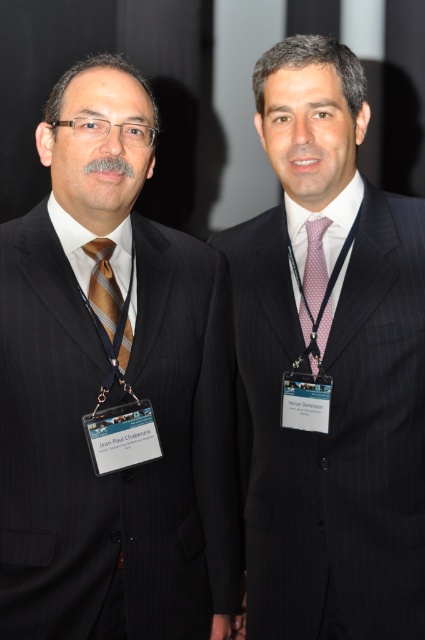
You are a photographer at a conference and need to capture a photo of both the pinstriped suit at left and the pinstriped suit at center. Since the backdrop is dark, you want to ensure both subjects are well lit. Which direction should you position the light source so that both suits receive equal lighting?

To ensure both the pinstriped suit at left and the pinstriped suit at center receive equal lighting, position the light source directly in front of them, facing towards the photographer. This way, the light will evenly illuminate both suits without favoring one side over the other due to their positioning.

You are a photographer setting up for a group photo. You need to ensure that both the pinstriped suit at left and the pink dotted fabric tie at center are in focus. The camera you are using has a depth of field that can sharply capture objects within a 16 inch range. Will both items be in focus?

The pinstriped suit at left is 16.52 inches away from the pink dotted fabric tie at center. Since the distance between them exceeds the camera s 16 inch depth of field range, not both items will be in focus simultaneously.

You are a photographer adjusting your camera settings to focus on the pinstriped suit at left and the pink dotted fabric tie at center. Which object should you focus on first to ensure both are in sharp focus?

The pinstriped suit at left is closer to the viewer than the pink dotted fabric tie at center, so focus on the pinstriped suit at left first to ensure both are in sharp focus.